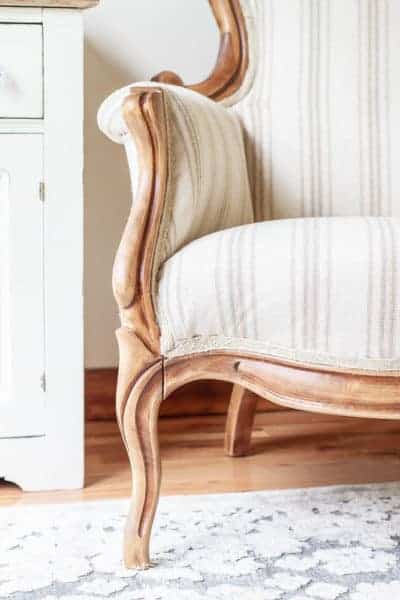
Locate an element on the screen. edge of area rug is located at coordinates (225, 493).